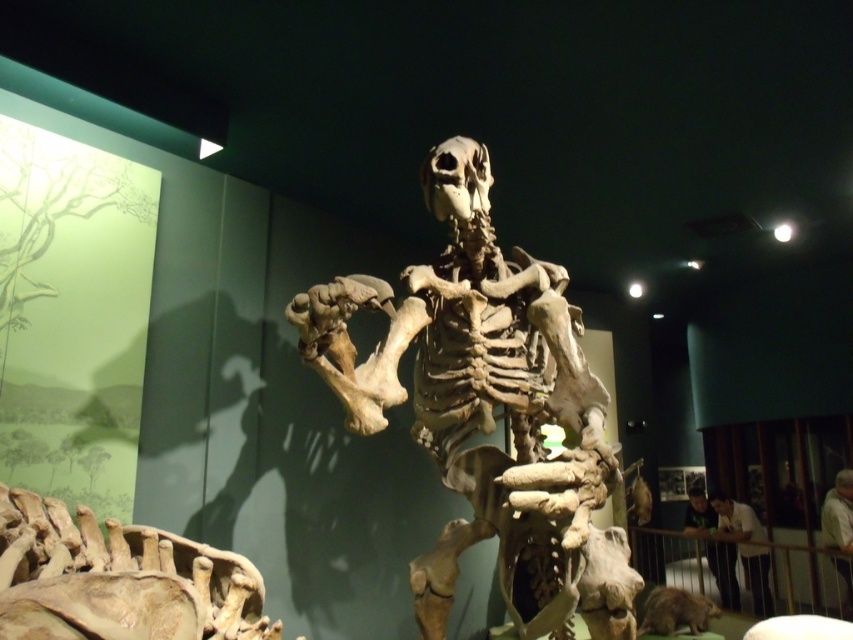
Question: Is brown bone-like skeleton at center to the right of brown furry animal at lower right from the viewer's perspective?

Choices:
 (A) yes
 (B) no

Answer: (B)

Question: Among these points, which one is nearest to the camera?

Choices:
 (A) (833, 545)
 (B) (706, 604)
 (C) (711, 528)

Answer: (B)

Question: Is brown bone-like skeleton at center wider than light brown skin at lower right?

Choices:
 (A) no
 (B) yes

Answer: (B)

Question: Estimate the real-world distances between objects in this image. Which object is closer to the brown bone-like skeleton at center?

Choices:
 (A) light brown skin at lower right
 (B) white cloth shirt at lower right
 (C) light brown shirt at lower right
 (D) brown furry animal at lower right

Answer: (D)

Question: Can you confirm if brown bone-like skeleton at center is wider than white cloth shirt at lower right?

Choices:
 (A) yes
 (B) no

Answer: (A)

Question: Which point is closer to the camera?

Choices:
 (A) (537, 480)
 (B) (764, 577)
 (C) (689, 627)
 (D) (468, 211)

Answer: (A)